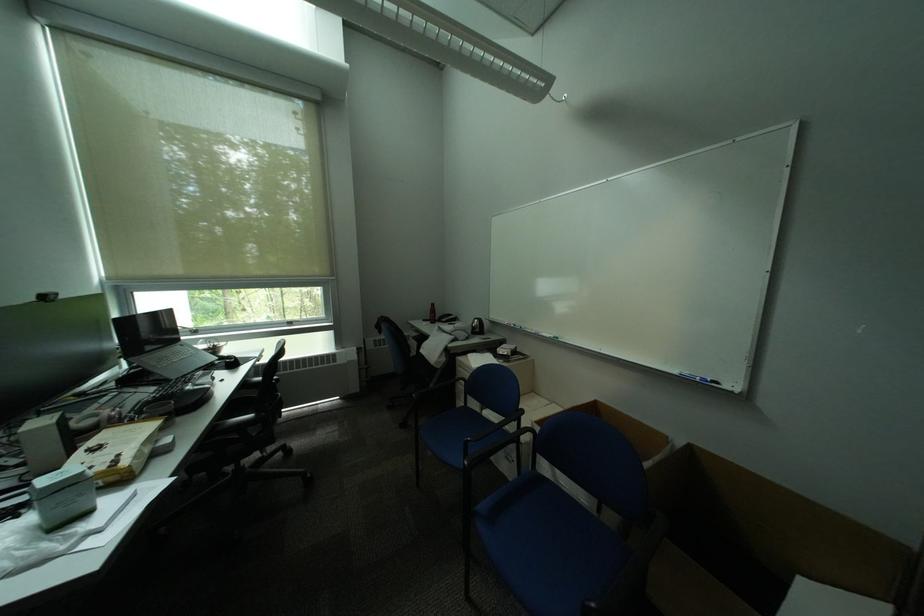
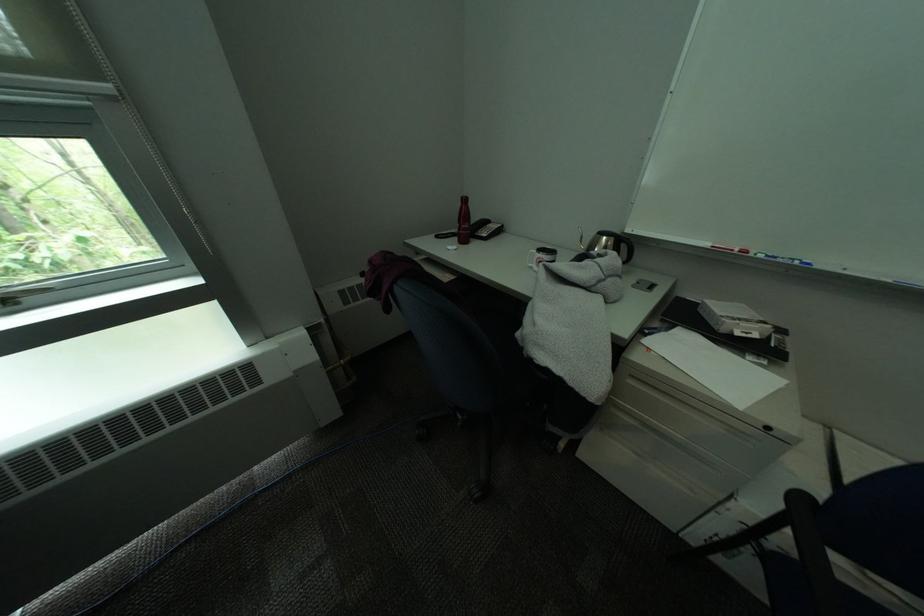
The point at (x=527, y=329) is marked in the first image. Where is the corresponding point in the second image?

(791, 262)